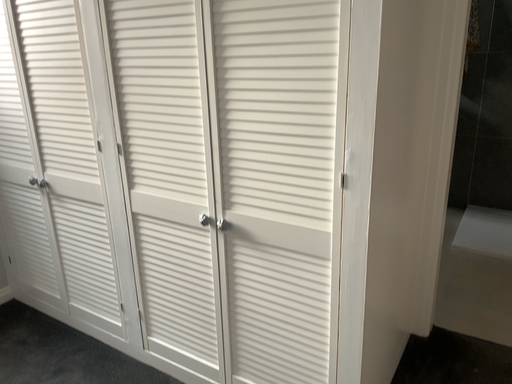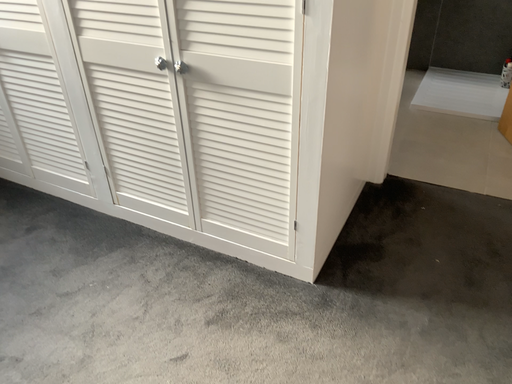
Question: How did the camera likely rotate when shooting the video?

Choices:
 (A) rotated downward
 (B) rotated upward

Answer: (A)